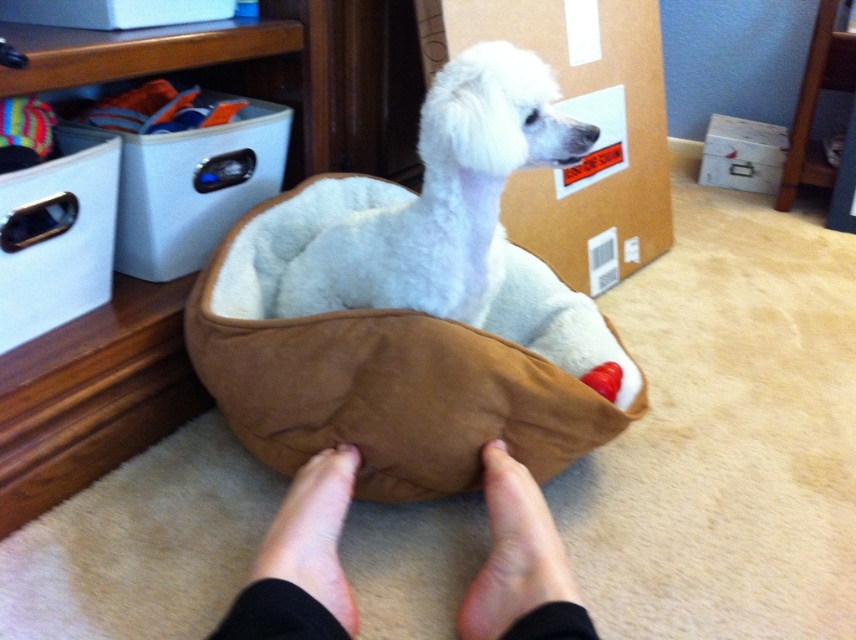
Between brown suede cat bed at center and skinny barefoot at lower center, which one is positioned higher?

brown suede cat bed at center

Who is positioned more to the right, brown suede cat bed at center or skinny barefoot at lower center?

Positioned to the right is brown suede cat bed at center.

What are the coordinates of `brown suede cat bed at center` in the screenshot? It's located at (397, 362).

You are a GUI agent. You are given a task and a screenshot of the screen. Output one action in this format:
    pyautogui.click(x=<x>, y=<y>)
    Task: Click on the brown suede cat bed at center
    
    Given the screenshot: What is the action you would take?
    pyautogui.click(x=397, y=362)

Is point (490, 13) in front of point (22, 342)?

No, (490, 13) is behind (22, 342).

Based on the photo, who is lower down, cardboard at upper center or white cardboard box at upper left?

white cardboard box at upper left

This screenshot has width=856, height=640. In order to click on cardboard at upper center in this screenshot , I will do `click(583, 120)`.

This screenshot has width=856, height=640. Identify the location of cardboard at upper center. (583, 120).

Who is positioned more to the right, brown suede cat bed at center or white cardboard box at upper left?

Positioned to the right is brown suede cat bed at center.

Is brown suede cat bed at center above white cardboard box at upper left?

No.

Does point (414, 404) come closer to viewer compared to point (19, 333)?

That is True.

This screenshot has width=856, height=640. I want to click on brown suede cat bed at center, so click(x=397, y=362).